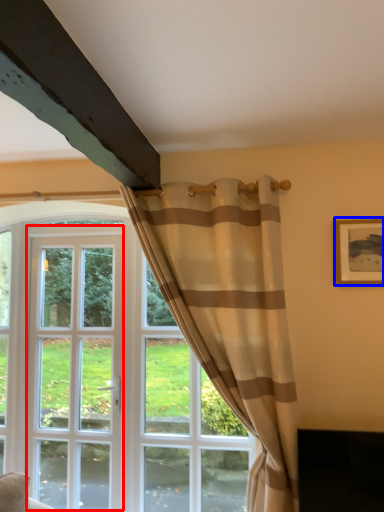
Question: Which object appears farthest to the camera in this image, screen door (highlighted by a red box) or picture frame (highlighted by a blue box)?

Choices:
 (A) screen door
 (B) picture frame

Answer: (A)